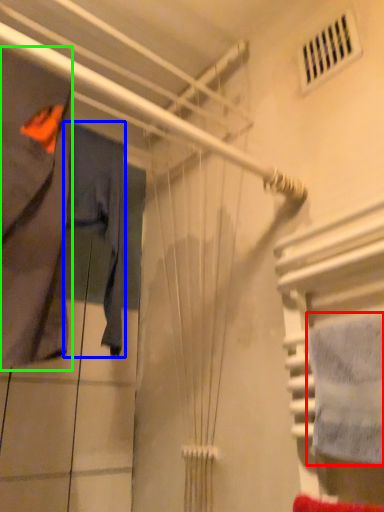
Question: Considering the real-world distances, which object is farthest from towel (highlighted by a red box)? clothing (highlighted by a blue box) or clothing (highlighted by a green box)?

Choices:
 (A) clothing
 (B) clothing

Answer: (A)